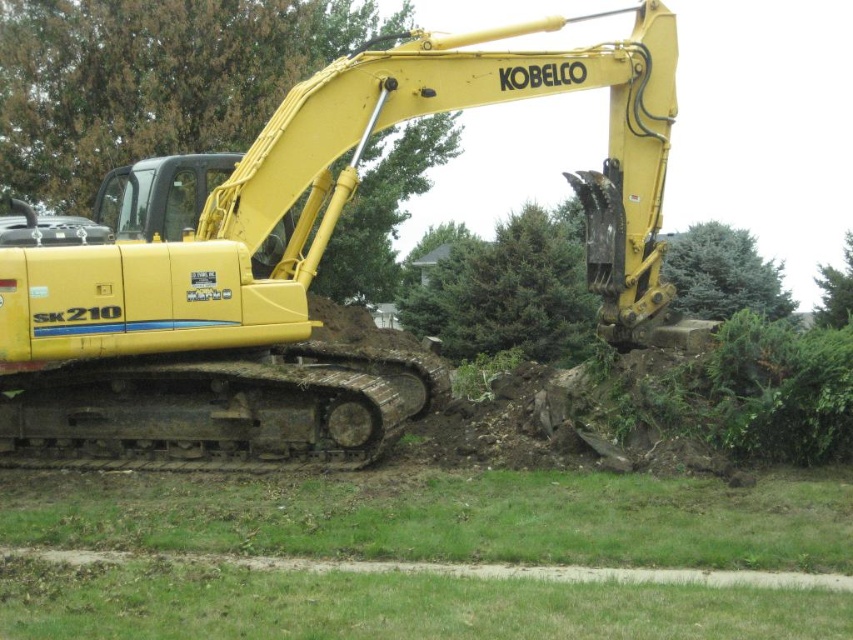
You are a construction worker standing at the origin point of a coordinate system. You need to locate the yellow rubber tractor at center. What are its coordinates?

The yellow rubber tractor at center is located at coordinates (299, 268).